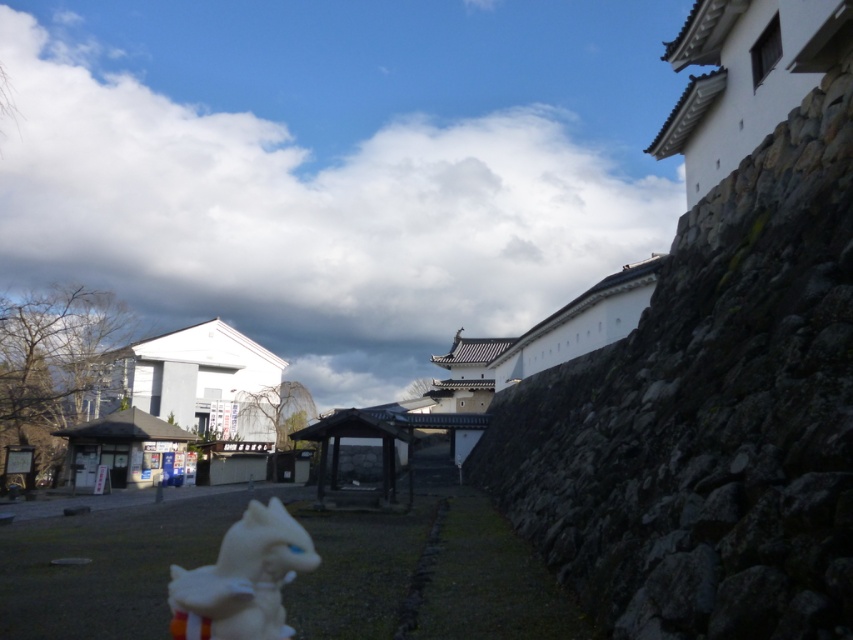
Consider the image. You are a photographer wanting to capture both the white fluffy cloud at upper center and the white plush toy at lower center in the same frame. Which object should you focus on to ensure both are in focus?

The white fluffy cloud at upper center is much taller than the white plush toy at lower center, so focusing on the white fluffy cloud at upper center will help ensure both are in focus.

You are a photographer trying to capture the white fluffy cloud at upper center and the white plush toy at lower center in the same frame. Which object would you need to zoom in more on to ensure both are clearly visible?

The white fluffy cloud at upper center might be wider than the white plush toy at lower center, so you should zoom in on the white fluffy cloud at upper center to ensure both are clearly visible.

You are a photographer standing at the base of the large stone wall on the right side of the scene. You want to capture a photo that includes both the large stone wall and the white fluffy cloud at upper center. Given that your camera has a maximum focus range of 700 feet, will you be able to focus on both the wall and the cloud in the same shot?

The white fluffy cloud at upper center is 730.12 feet away from the camera, which exceeds the camera maximum focus range of 700 feet. Therefore, the camera cannot focus on both the large stone wall and the white fluffy cloud at upper center simultaneously.